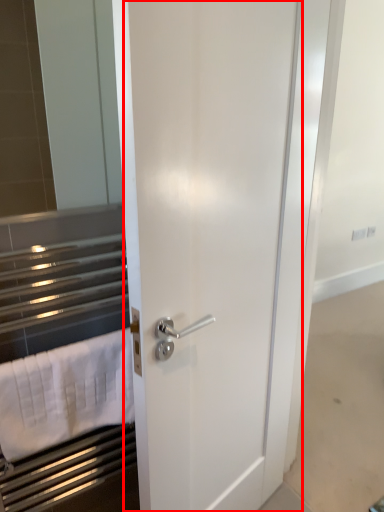
Question: From the image's perspective, where is door (annotated by the red box) located in relation to bath towel in the image?

Choices:
 (A) above
 (B) below

Answer: (A)